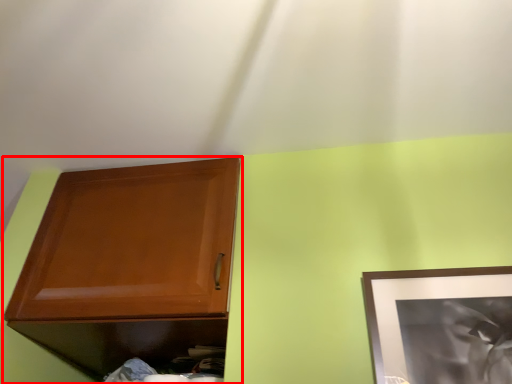
Question: From the image's perspective, what is the correct spatial relationship of cabinetry (annotated by the red box) in relation to picture frame?

Choices:
 (A) below
 (B) above

Answer: (A)